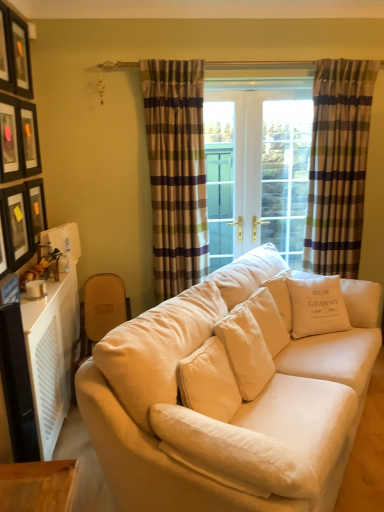
Identify the location of vacant space situated above plaid fabric curtain at center, which ranks as the 1th curtain in left-to-right order (from a real-world perspective). (173, 61).